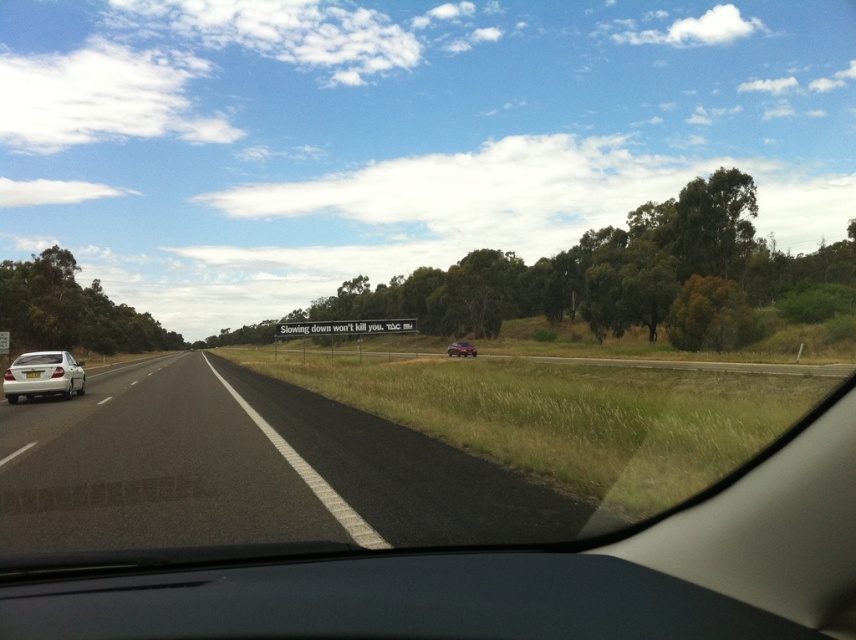
You are a driver in a vehicle on a highway. You see a silver metallic sedan at left represented by point (43, 376). Can you determine if the silver metallic sedan at left is in front of or behind your vehicle based on its position?

The silver metallic sedan at left represented by point (43, 376) is positioned in front of your vehicle since it is further along the road in the direction of travel.

You are a driver in a vehicle and want to overtake the metallic silver car at center on the black asphalt road at center. What is the minimum distance you need to wait before attempting to overtake safely?

The black asphalt road at center and metallic silver car at center are 40.94 meters apart. To safely overtake, you should wait until the distance between your vehicle and the metallic silver car at center is at least 40.94 meters.

You are driving a metallic silver car at center and want to change lanes to the right. Considering the black asphalt road at center, is there enough space to safely maneuver into the adjacent lane without encroaching on other vehicles?

The black asphalt road at center is wider than the metallic silver car at center, so there should be sufficient space to safely change lanes to the right as long as there are no other vehicles in the adjacent lane.